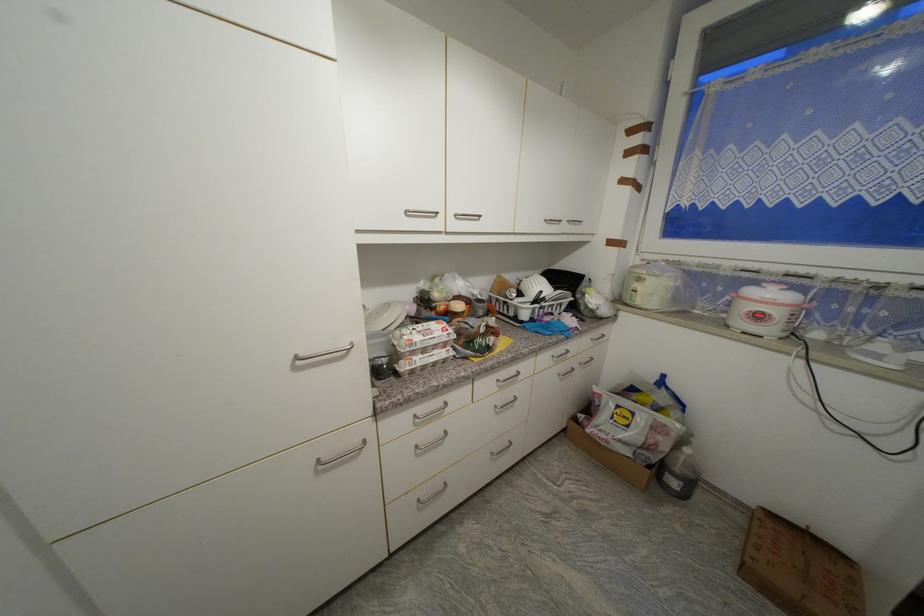
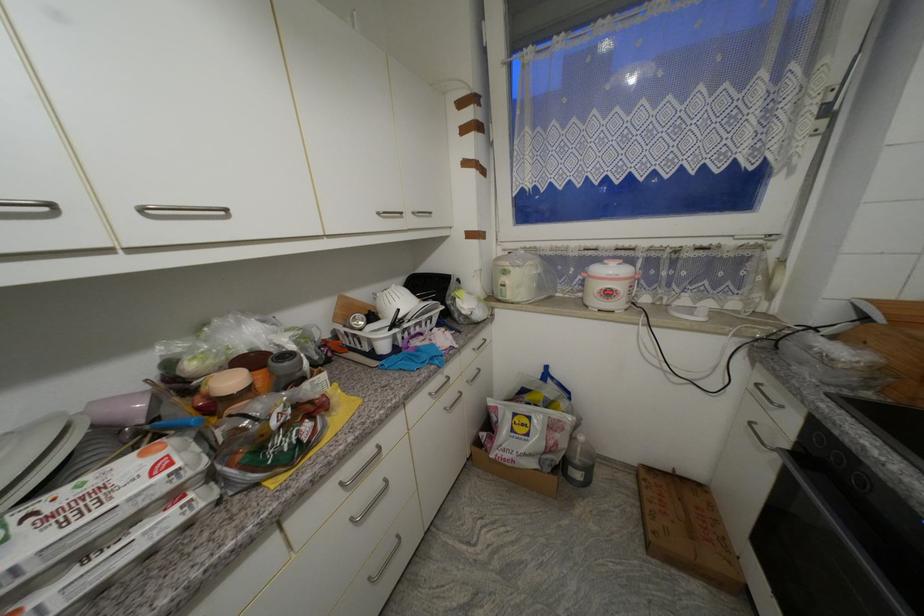
The point at (502, 408) is marked in the first image. Where is the corresponding point in the second image?

(358, 521)